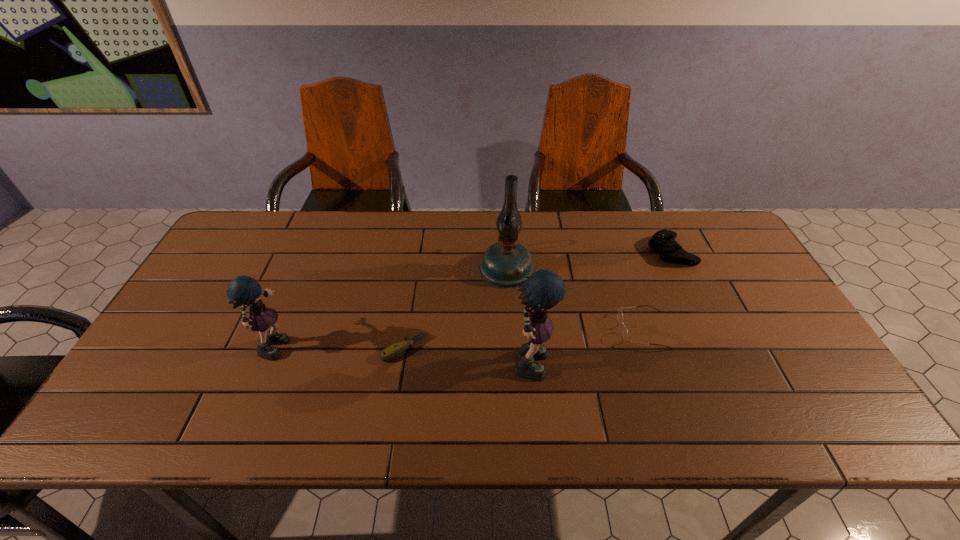
Where is `object located at the near edge`? object located at the near edge is located at coordinates (544, 289).

At what (x,y) coordinates should I click in order to perform the action: click on object that is at the right edge. Please return your answer as a coordinate pair (x, y). This screenshot has height=540, width=960. Looking at the image, I should click on (663, 241).

This screenshot has width=960, height=540. What are the coordinates of `object that is at the far right corner` in the screenshot? It's located at (663, 241).

In the image, there is a desktop. Identify the location of vacant space at the far edge. (372, 219).

Where is `free space at the near edge of the desktop`? This screenshot has width=960, height=540. free space at the near edge of the desktop is located at coordinates (676, 379).

Where is `free space at the right edge of the desktop`? This screenshot has height=540, width=960. free space at the right edge of the desktop is located at coordinates (713, 270).

This screenshot has width=960, height=540. In the image, there is a desktop. What are the coordinates of `vacant space at the far right corner` in the screenshot? It's located at (710, 253).

This screenshot has height=540, width=960. I want to click on free space between the fifth object from left to right and the taller rag doll, so click(x=587, y=344).

At what (x,y) coordinates should I click in order to perform the action: click on vacant space that's between the right rag doll and the pocketknife. Please return your answer as a coordinate pair (x, y). The height and width of the screenshot is (540, 960). Looking at the image, I should click on (468, 353).

At what (x,y) coordinates should I click in order to perform the action: click on free spot between the second shortest object and the leftmost object. Please return your answer as a coordinate pair (x, y). This screenshot has height=540, width=960. Looking at the image, I should click on (460, 336).